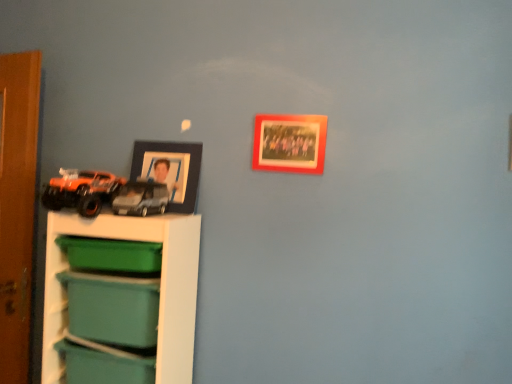
Question: From a real-world perspective, is black matte picture frame at upper left, the 1th picture frame viewed from the left, on orange matte truck at left, arranged as the 2th toy when viewed from the right?

Choices:
 (A) no
 (B) yes

Answer: (B)

Question: Does black matte picture frame at upper left, which is the 1th picture frame from back to front, contain orange matte truck at left, arranged as the 2th toy when viewed from the right?

Choices:
 (A) yes
 (B) no

Answer: (B)

Question: Is black matte picture frame at upper left, which is the 1th picture frame from back to front, aimed at orange matte truck at left, arranged as the 2th toy when viewed from the right?

Choices:
 (A) no
 (B) yes

Answer: (B)

Question: From the image's perspective, would you say black matte picture frame at upper left, which is the 1th picture frame from back to front, is positioned over orange matte truck at left, arranged as the 2th toy when viewed from the right?

Choices:
 (A) yes
 (B) no

Answer: (A)

Question: Can you confirm if black matte picture frame at upper left, arranged as the second picture frame when viewed from the front, is shorter than orange matte truck at left, arranged as the 2th toy when viewed from the right?

Choices:
 (A) yes
 (B) no

Answer: (B)

Question: In terms of width, does white plastic shelf at lower left look wider or thinner when compared to teal plastic storage box at lower left, which is counted as the third storage box, starting from the top?

Choices:
 (A) wide
 (B) thin

Answer: (A)

Question: Is white plastic shelf at lower left taller or shorter than teal plastic storage box at lower left, which is counted as the third storage box, starting from the top?

Choices:
 (A) short
 (B) tall

Answer: (B)

Question: In the image, is white plastic shelf at lower left on the left side or the right side of teal plastic storage box at lower left, the 1th storage box ordered from the bottom?

Choices:
 (A) left
 (B) right

Answer: (B)

Question: From the image's perspective, relative to teal plastic storage box at lower left, the 1th storage box ordered from the bottom, is white plastic shelf at lower left above or below?

Choices:
 (A) below
 (B) above

Answer: (B)

Question: From the image's perspective, is black matte picture frame at upper left, the 1th picture frame viewed from the left, located above or below green plastic storage box at lower left, the 3th storage box ordered from the bottom?

Choices:
 (A) above
 (B) below

Answer: (A)

Question: Which is correct: black matte picture frame at upper left, arranged as the second picture frame when viewed from the front, is inside green plastic storage box at lower left, the 3th storage box ordered from the bottom, or outside of it?

Choices:
 (A) outside
 (B) inside

Answer: (A)

Question: In terms of size, does black matte picture frame at upper left, the 2th picture frame in the right-to-left sequence, appear bigger or smaller than green plastic storage box at lower left, the first storage box when ordered from top to bottom?

Choices:
 (A) small
 (B) big

Answer: (A)

Question: Considering the positions of point [x=160, y=178] and point [x=79, y=266], is point [x=160, y=178] closer or farther from the camera than point [x=79, y=266]?

Choices:
 (A) farther
 (B) closer

Answer: (A)

Question: From the image's perspective, is orange matte truck at left, which is counted as the first toy, starting from the left, positioned above or below green plastic storage box at lower left, the 3th storage box ordered from the bottom?

Choices:
 (A) above
 (B) below

Answer: (A)

Question: In terms of size, does orange matte truck at left, arranged as the 2th toy when viewed from the right, appear bigger or smaller than green plastic storage box at lower left, the 3th storage box ordered from the bottom?

Choices:
 (A) big
 (B) small

Answer: (A)